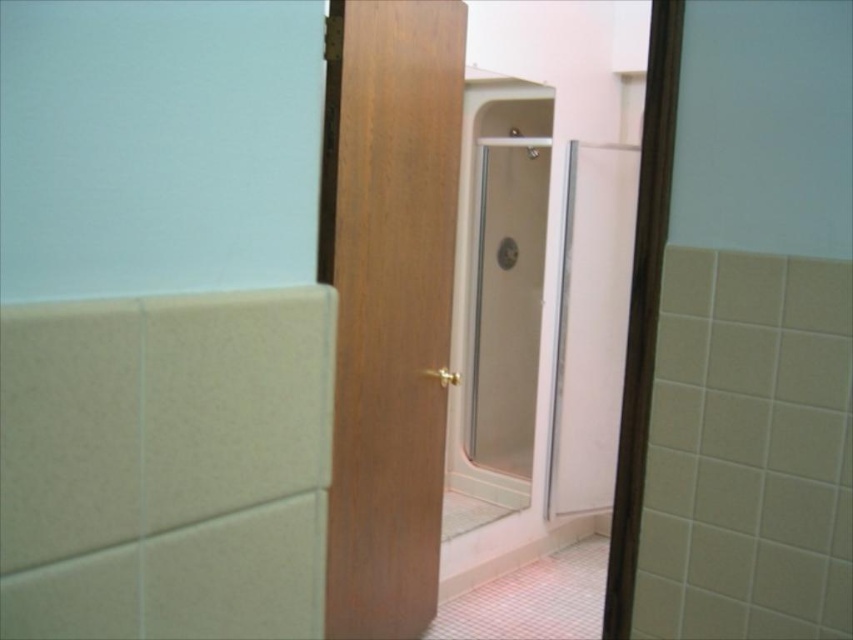
This screenshot has height=640, width=853. Describe the element at coordinates (387, 301) in the screenshot. I see `wooden door at center` at that location.

Based on the photo, between wooden door at center and clear glass shower door at center, which one appears on the left side from the viewer's perspective?

wooden door at center

Identify the location of wooden door at center. (387, 301).

The height and width of the screenshot is (640, 853). Identify the location of wooden door at center. (387, 301).